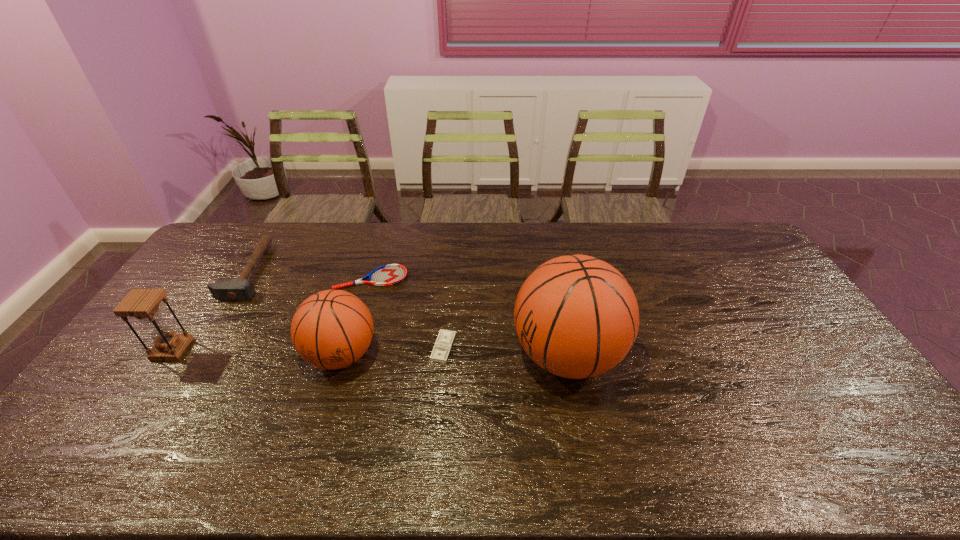
Find the location of a particular element. The width and height of the screenshot is (960, 540). free space at the left edge is located at coordinates (193, 292).

The width and height of the screenshot is (960, 540). What are the coordinates of `vacant space at the right edge of the desktop` in the screenshot? It's located at (806, 319).

Locate an element on the screen. Image resolution: width=960 pixels, height=540 pixels. vacant space at the far left corner is located at coordinates (219, 235).

At what (x,y) coordinates should I click in order to perform the action: click on empty space that is in between the tallest object and the hourglass. Please return your answer as a coordinate pair (x, y). This screenshot has height=540, width=960. Looking at the image, I should click on (370, 353).

Image resolution: width=960 pixels, height=540 pixels. Identify the location of free space that is in between the fifth object from left to right and the taller basketball. (505, 352).

The image size is (960, 540). I want to click on free spot between the second object from right to left and the left basketball, so click(x=393, y=352).

In order to click on vacant space that's between the left basketball and the money in this screenshot , I will do `click(393, 352)`.

Locate an element on the screen. vacant space that's between the tennis racket and the hourglass is located at coordinates (272, 314).

This screenshot has width=960, height=540. Find the location of `free space between the tennis racket and the fourth tallest object`. free space between the tennis racket and the fourth tallest object is located at coordinates (310, 275).

This screenshot has width=960, height=540. Find the location of `free space between the fifth object from left to right and the tennis racket`. free space between the fifth object from left to right and the tennis racket is located at coordinates (407, 313).